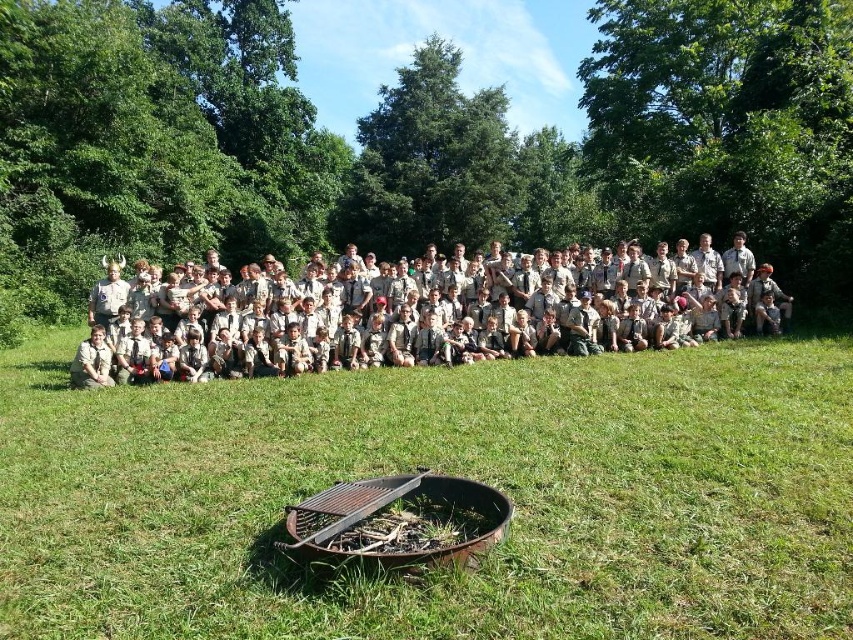
You are standing at the edge of the grassy area and see the green grass at center and the black metal fire pit at lower center. Which object is closer to you?

The green grass at center is closer to you because it is in front of the black metal fire pit at lower center.

You are a scout leader who needs to set up a tent. You have a tent that requires a 1.5 meter clearance area. Is there enough space between the green grass at center and the black metal fire pit at lower center to set up the tent?

The green grass at center is 1.36 meters away from the black metal fire pit at lower center. Since the required clearance is 1.5 meters, there isn not enough space between them to set up the tent.

Based on the scene description, where is the green grass at center located in terms of its 2D coordinates?

The green grass at center is located at the 2D coordinates point (445, 472).